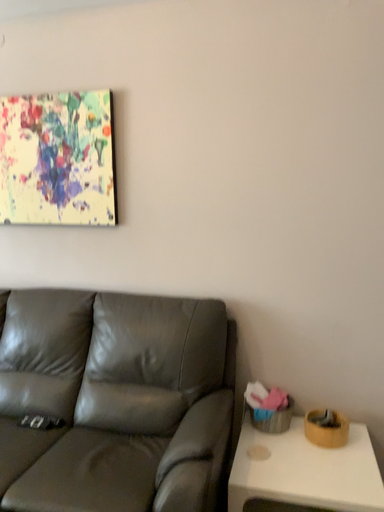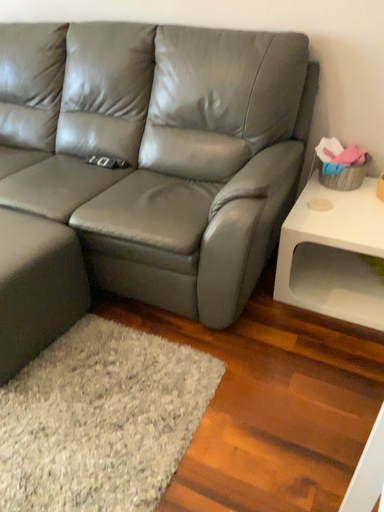
Question: How did the camera likely rotate when shooting the video?

Choices:
 (A) rotated left
 (B) rotated right

Answer: (A)